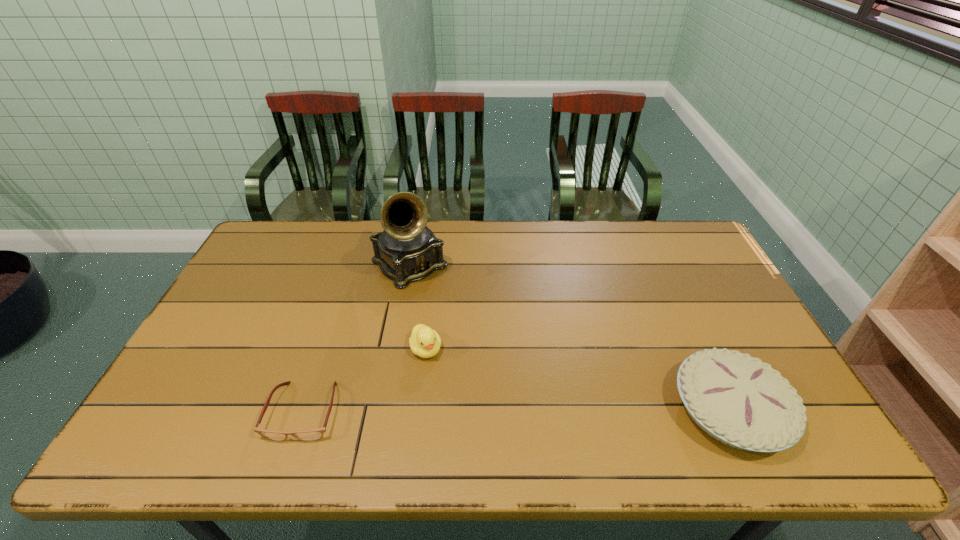
The image size is (960, 540). I want to click on vacant region located on the beak of the duckling, so click(456, 414).

At what (x,y) coordinates should I click in order to perform the action: click on vacant region located 0.100m on the beak of the duckling. Please return your answer as a coordinate pair (x, y). The height and width of the screenshot is (540, 960). Looking at the image, I should click on (445, 392).

You are a GUI agent. You are given a task and a screenshot of the screen. Output one action in this format:
    pyautogui.click(x=<x>, y=<y>)
    Task: Click on the object present at the far edge
    Image resolution: width=960 pixels, height=540 pixels.
    Given the screenshot: What is the action you would take?
    pyautogui.click(x=407, y=250)

Where is `spectacles positioned at the near edge`? The image size is (960, 540). spectacles positioned at the near edge is located at coordinates (314, 434).

At what (x,y) coordinates should I click in order to perform the action: click on pie at the near edge. Please return your answer as a coordinate pair (x, y). The image size is (960, 540). Looking at the image, I should click on (737, 399).

Find the location of `object present at the right edge`. object present at the right edge is located at coordinates (737, 399).

Identify the location of object that is at the near right corner. (737, 399).

Image resolution: width=960 pixels, height=540 pixels. I want to click on free spot at the far edge of the desktop, so click(x=464, y=228).

This screenshot has height=540, width=960. Identify the location of vacant region at the near edge of the desktop. (468, 397).

Where is `free space at the left edge of the desktop`? Image resolution: width=960 pixels, height=540 pixels. free space at the left edge of the desktop is located at coordinates (179, 387).